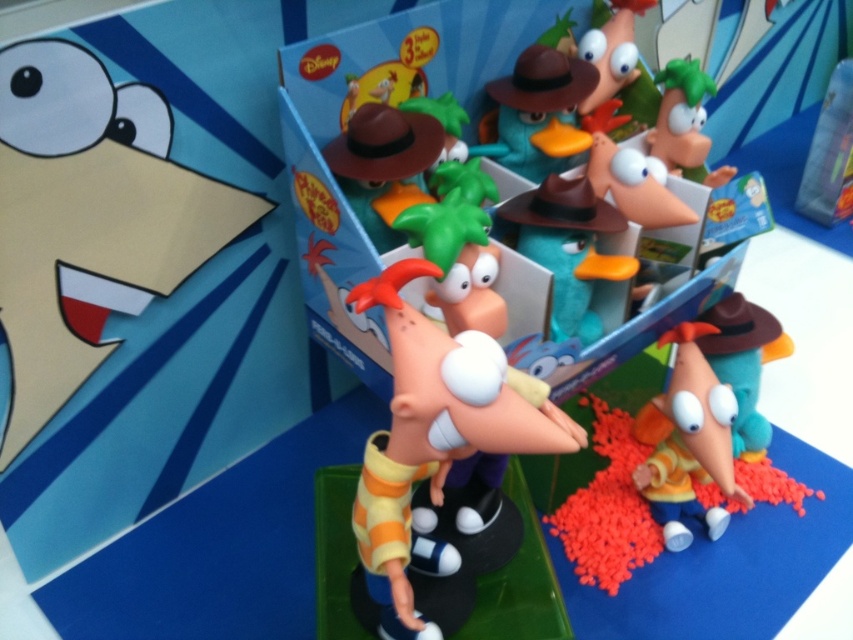
Question: Which object is the closest to the yellow matte toy at center?

Choices:
 (A) matte plastic toy at center
 (B) yellow matte duck at upper left

Answer: (A)

Question: Based on their relative distances, which object is farther from the yellow matte duck at upper left?

Choices:
 (A) yellow matte toy at center
 (B) matte brown hat at upper center
 (C) matte plastic toy at center

Answer: (A)

Question: Is the position of yellow matte toy at center less distant than that of matte brown hat at upper center?

Choices:
 (A) yes
 (B) no

Answer: (A)

Question: Which object is farther from the camera taking this photo?

Choices:
 (A) yellow matte toy at center
 (B) yellow matte duck at upper left
 (C) matte plastic toy box at center
 (D) matte brown hat at upper center

Answer: (D)

Question: Can you confirm if yellow matte duck at upper left is thinner than matte brown hat at upper center?

Choices:
 (A) yes
 (B) no

Answer: (B)

Question: From the image, what is the correct spatial relationship of yellow matte duck at upper left in relation to yellow matte toy at center?

Choices:
 (A) above
 (B) below

Answer: (A)